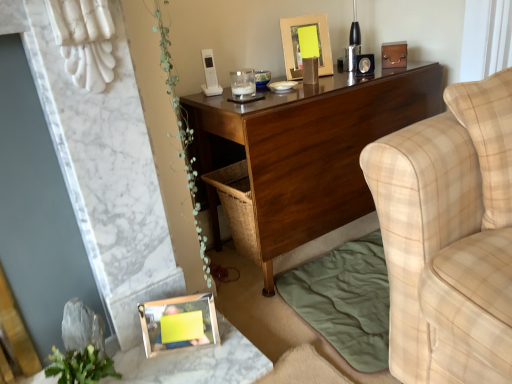
What are the coordinates of `vacant area located to the right-hand side of green leafy plant at lower left` in the screenshot? It's located at (130, 355).